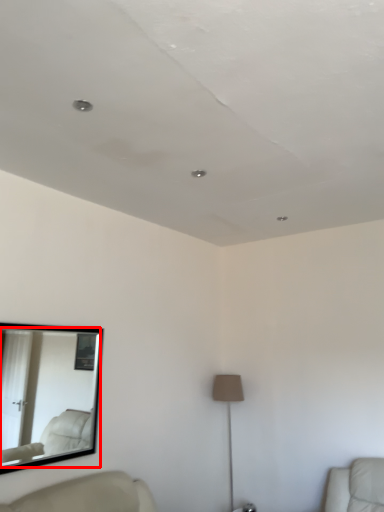
Question: From the image's perspective, what is the correct spatial relationship of mirror (annotated by the red box) in relation to lamp?

Choices:
 (A) above
 (B) below

Answer: (A)